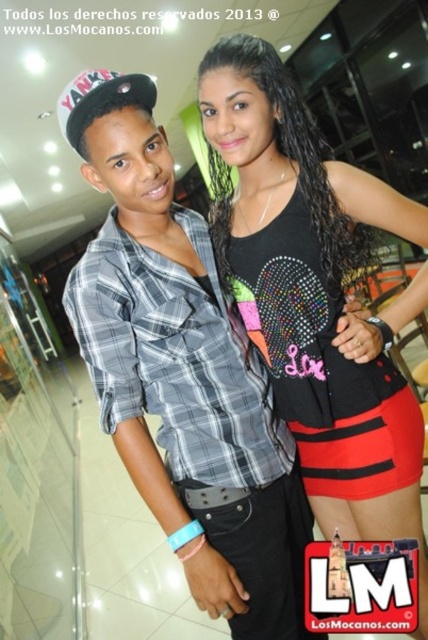
Question: Is plaid fabric shirt at center smaller than black sequined tank top at center?

Choices:
 (A) yes
 (B) no

Answer: (B)

Question: Does plaid fabric shirt at center have a larger size compared to black sequined tank top at center?

Choices:
 (A) no
 (B) yes

Answer: (B)

Question: Which point appears farthest from the camera in this image?

Choices:
 (A) (155, 184)
 (B) (290, 280)

Answer: (B)

Question: Is plaid fabric shirt at center to the left of black sequined tank top at center from the viewer's perspective?

Choices:
 (A) no
 (B) yes

Answer: (B)

Question: Which point is closer to the camera taking this photo?

Choices:
 (A) (312, 458)
 (B) (107, 417)

Answer: (B)